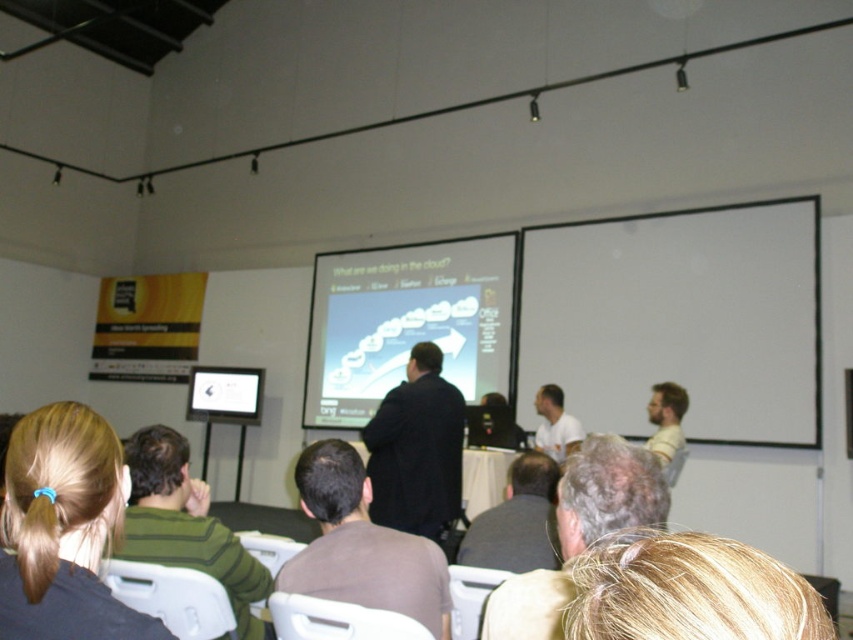
Question: Where is brown matte shirt at center located in relation to white matte shirt at center in the image?

Choices:
 (A) below
 (B) above

Answer: (B)

Question: Does brown matte shirt at center appear under light brown hair at center?

Choices:
 (A) yes
 (B) no

Answer: (B)

Question: Which is farther from the white matte shirt at center?

Choices:
 (A) gray fabric shirt at center
 (B) gray hair at center

Answer: (B)

Question: Does green striped sweater at left have a lesser width compared to gray fabric shirt at center?

Choices:
 (A) no
 (B) yes

Answer: (A)

Question: Estimate the real-world distances between objects in this image. Which object is farther from the gray fabric shirt at center?

Choices:
 (A) blonde hair at lower left
 (B) gray hair at center
 (C) matte white projector screen at center
 (D) green striped sweater at left

Answer: (C)

Question: Which of the following is the closest to the observer?

Choices:
 (A) (521, 506)
 (B) (143, 458)
 (C) (325, 541)
 (D) (799, 440)

Answer: (C)